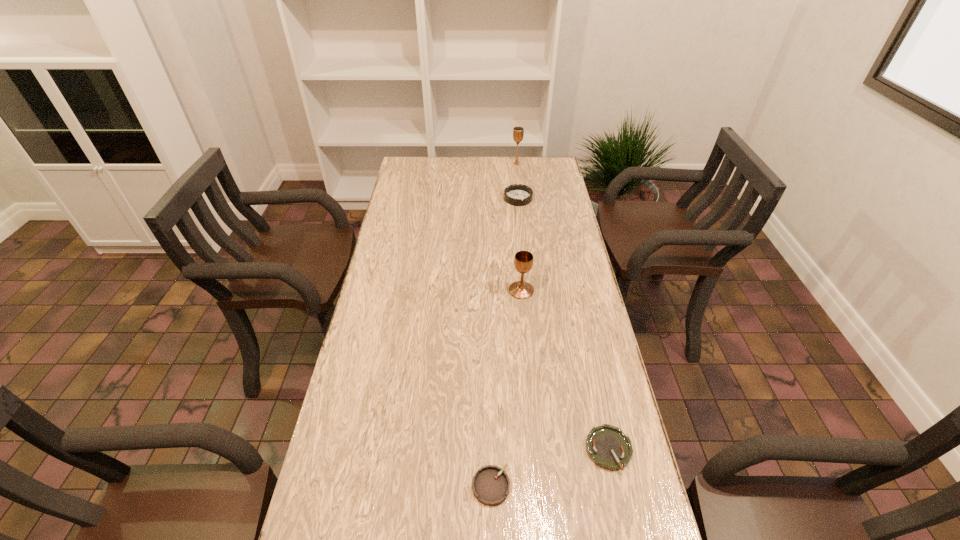
Locate an element on the screen. This screenshot has height=540, width=960. the farther chalice is located at coordinates (518, 132).

Identify the location of the farthest object. pyautogui.click(x=518, y=132).

Image resolution: width=960 pixels, height=540 pixels. In order to click on the nearer chalice in this screenshot , I will do `click(523, 261)`.

Locate an element on the screen. the third farthest object is located at coordinates (523, 261).

What are the coordinates of `the second farthest object` in the screenshot? It's located at (517, 194).

Image resolution: width=960 pixels, height=540 pixels. Identify the location of the second ashtray from left to right. (517, 194).

Find the location of a particular element. The width and height of the screenshot is (960, 540). the leftmost ashtray is located at coordinates (491, 485).

You are a GUI agent. You are given a task and a screenshot of the screen. Output one action in this format:
    pyautogui.click(x=<x>, y=<y>)
    Task: Click on the shortest ashtray
    
    Given the screenshot: What is the action you would take?
    pyautogui.click(x=609, y=448)

The image size is (960, 540). What are the coordinates of `the rightmost ashtray` in the screenshot? It's located at [609, 448].

The width and height of the screenshot is (960, 540). What are the coordinates of `free point located 0.200m on the left of the taller chalice` in the screenshot? It's located at (468, 164).